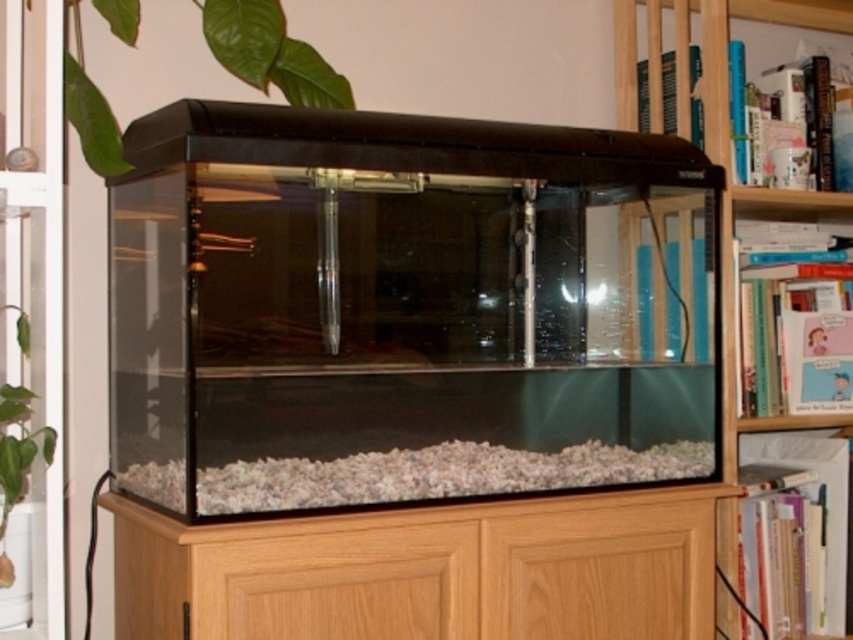
Does white gravel at bottom come in front of wooden bookshelf at upper right?

That is True.

Measure the distance between white gravel at bottom and wooden bookshelf at upper right.

A distance of 25.58 inches exists between white gravel at bottom and wooden bookshelf at upper right.

Measure the distance between point (392, 499) and camera.

Point (392, 499) and camera are 3.94 feet apart.

Find the location of a particular element. This screenshot has width=853, height=640. white gravel at bottom is located at coordinates (437, 474).